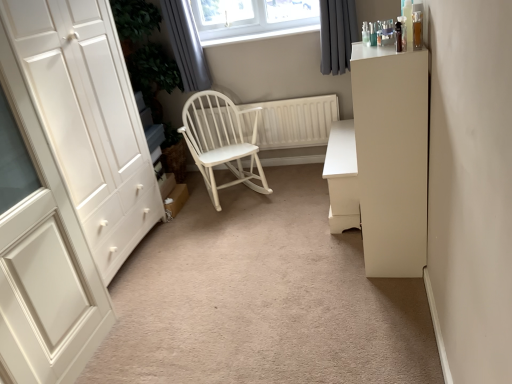
Locate an element on the screen. Image resolution: width=512 pixels, height=384 pixels. free spot in front of white wood rocking chair at center is located at coordinates [x=236, y=226].